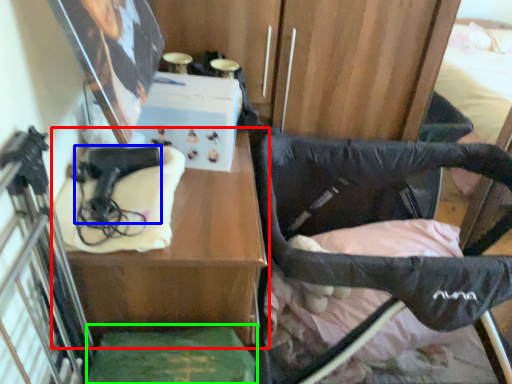
Question: Which is farther away from table (highlighted by a red box)? handgun (highlighted by a blue box) or wide (highlighted by a green box)?

Choices:
 (A) handgun
 (B) wide

Answer: (A)